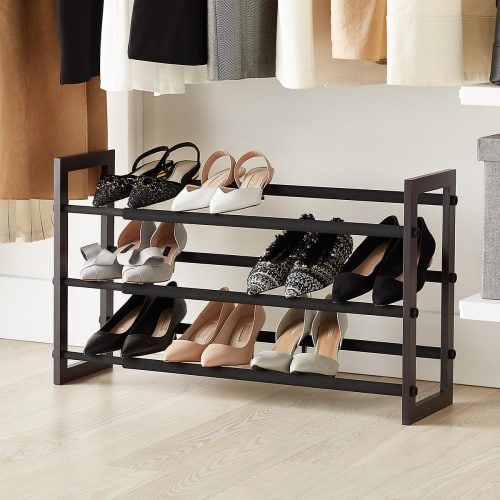
I want to click on shoes on middle shelf, so click(x=385, y=293), click(x=358, y=280), click(x=338, y=279), click(x=265, y=274), click(x=169, y=238), click(x=125, y=244).